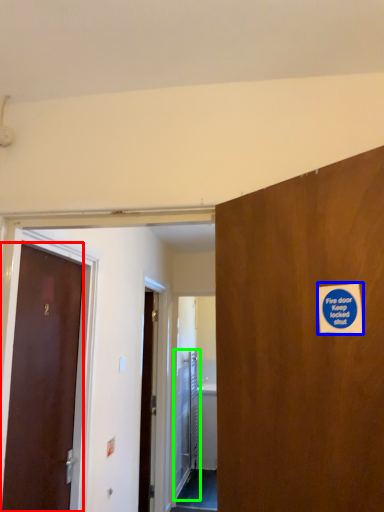
Question: Which object is the farthest from door (highlighted by a red box)? Choose among these: sticker (highlighted by a blue box) or elevator door (highlighted by a green box).

Choices:
 (A) sticker
 (B) elevator door

Answer: (B)